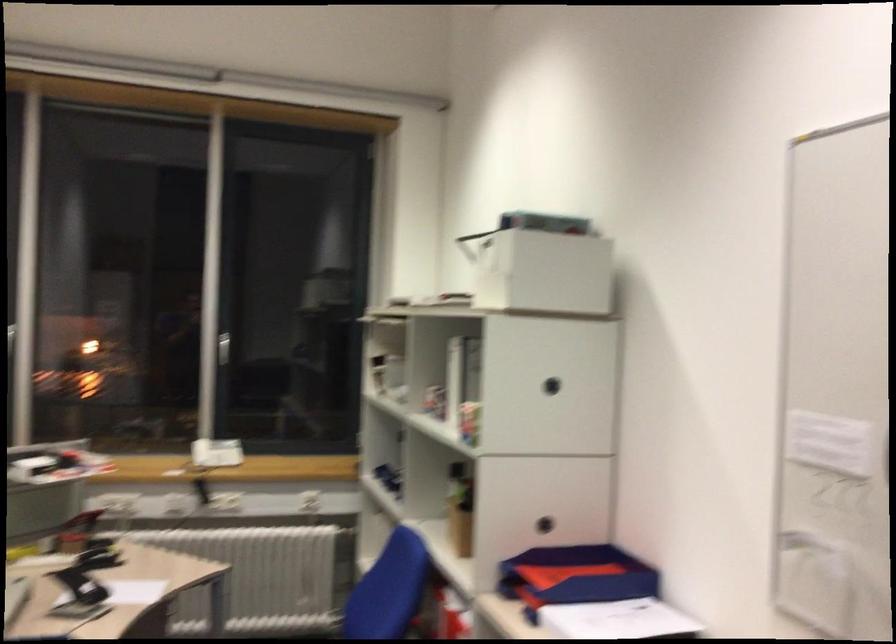
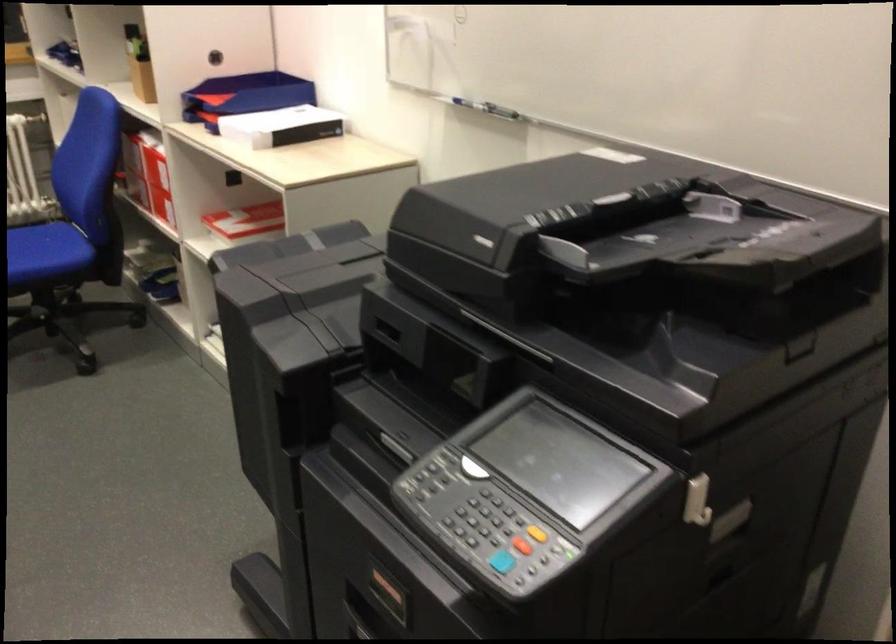
First-person continuous shooting, in which direction is the camera rotating?

The camera's rotation is toward right-down.